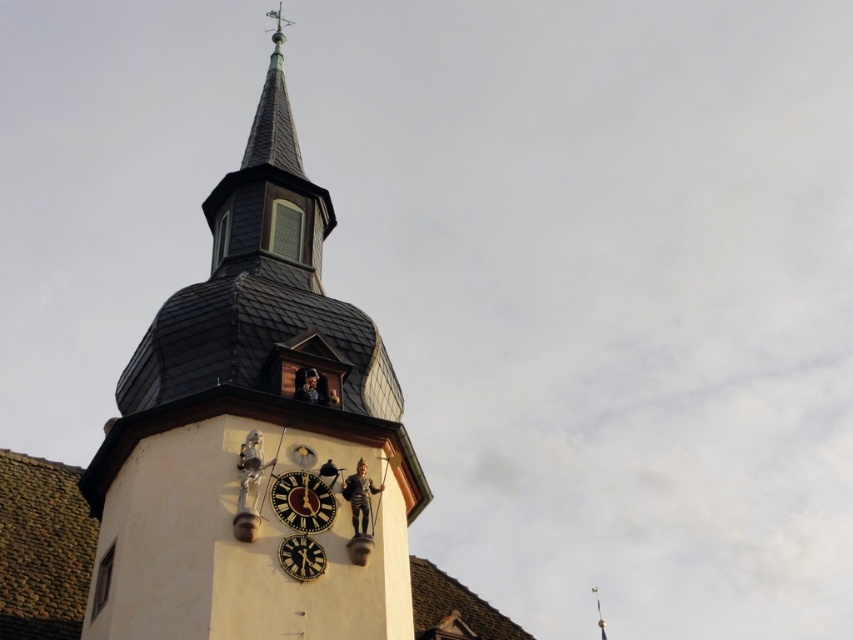
You are standing at the entrance of a historic building and want to locate the smooth gray stone clock tower at center. Based on the coordinates provided, in which direction should you look to find it?

The smooth gray stone clock tower at center is located at coordinates point (248, 428), which means it is positioned to the upper right of your current position.

You are an architect examining the historic building. You notice the smooth gray stone clock tower at center and the wooden clock at center. Which object is positioned closer to you?

The smooth gray stone clock tower at center is closer to the viewer than the wooden clock at center.

You are standing at the entrance of the historic building and want to locate the smooth gray stone clock tower at center. Based on the coordinates provided, in which direction should you look to find it?

The smooth gray stone clock tower at center is located at coordinates point (248, 428), so you should look to the upper right direction to find it.